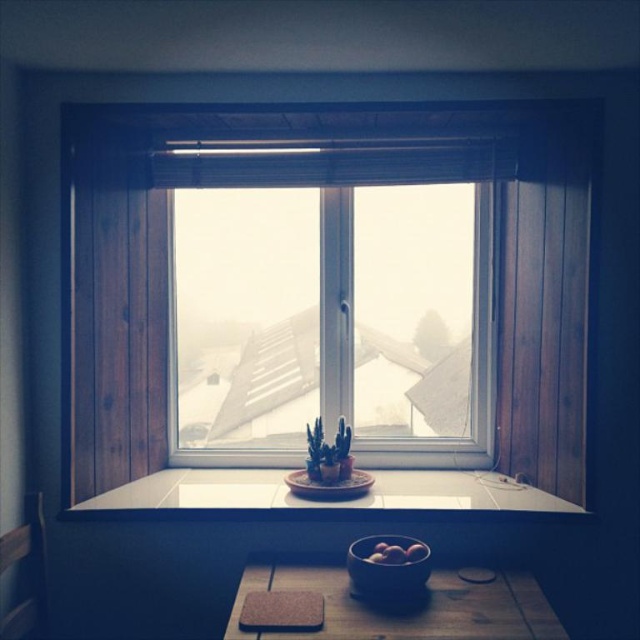
Which is more to the left, transparent glass window at center or white tile at center?

From the viewer's perspective, white tile at center appears more on the left side.

What are the coordinates of `transparent glass window at center` in the screenshot? It's located at (330, 184).

Locate an element on the screen. transparent glass window at center is located at coordinates (330, 184).

This screenshot has height=640, width=640. I want to click on transparent glass window at center, so click(x=330, y=184).

Is point (420, 476) behind point (390, 568)?

Yes.

Is point (189, 490) in front of point (346, 563)?

No, (189, 490) is further to viewer.

Locate an element on the screen. This screenshot has width=640, height=640. white tile at center is located at coordinates (324, 493).

Image resolution: width=640 pixels, height=640 pixels. Find the location of `white tile at center`. white tile at center is located at coordinates (324, 493).

Does transparent glass window at center have a smaller size compared to clear glass window at center?

Incorrect, transparent glass window at center is not smaller in size than clear glass window at center.

Who is taller, transparent glass window at center or clear glass window at center?

transparent glass window at center

Which is behind, point (150, 467) or point (296, 419)?

The point (296, 419) is behind.

The image size is (640, 640). Identify the location of transparent glass window at center. point(330,184).